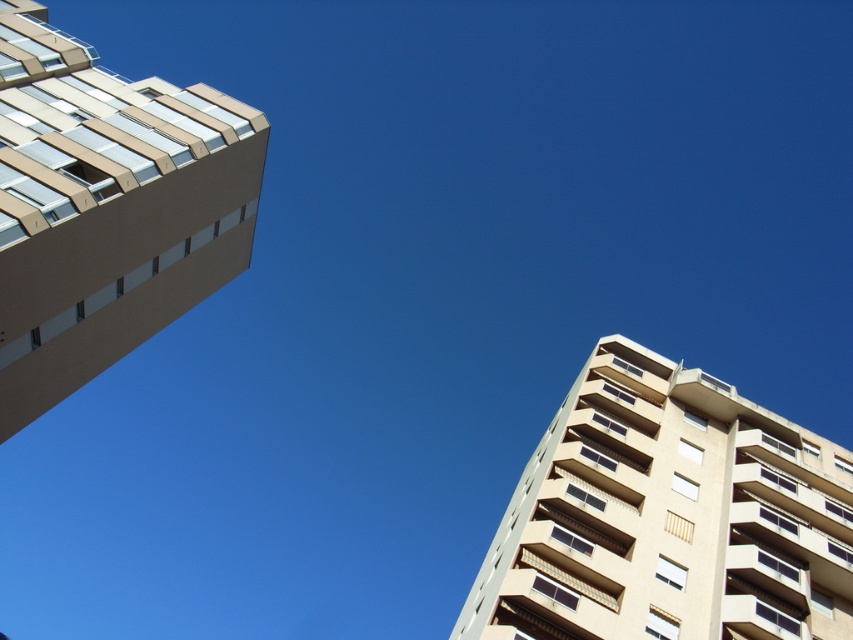
Does beige concrete building at right have a greater height compared to beige concrete building at left?

No.

Does beige concrete building at right appear on the left side of beige concrete building at left?

Incorrect, beige concrete building at right is not on the left side of beige concrete building at left.

I want to click on beige concrete building at right, so click(668, 516).

The width and height of the screenshot is (853, 640). Find the location of `beige concrete building at right`. beige concrete building at right is located at coordinates (668, 516).